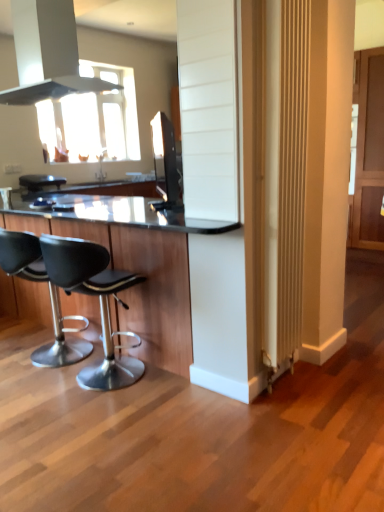
Question: Can you confirm if black leather bar stool at center is bigger than black leather stool at left, positioned as the 1th chair in right-to-left order?

Choices:
 (A) yes
 (B) no

Answer: (B)

Question: Can you confirm if black leather bar stool at center is wider than black leather stool at left, positioned as the 1th chair in right-to-left order?

Choices:
 (A) no
 (B) yes

Answer: (A)

Question: From a real-world perspective, does black leather bar stool at center stand above black leather stool at left, the second chair in the left-to-right sequence?

Choices:
 (A) no
 (B) yes

Answer: (B)

Question: Is black leather bar stool at center thinner than black leather stool at left, the second chair in the left-to-right sequence?

Choices:
 (A) yes
 (B) no

Answer: (A)

Question: Is black leather bar stool at center surrounding black leather stool at left, positioned as the 1th chair in right-to-left order?

Choices:
 (A) yes
 (B) no

Answer: (B)

Question: Is point (99, 366) closer or farther from the camera than point (23, 239)?

Choices:
 (A) farther
 (B) closer

Answer: (A)

Question: Looking at their shapes, would you say black leather stool at left, positioned as the 1th chair in right-to-left order, is wider or thinner than black leather stool at lower left, the first chair positioned from the left?

Choices:
 (A) wide
 (B) thin

Answer: (B)

Question: From the image's perspective, relative to black leather stool at lower left, the first chair positioned from the left, is black leather stool at left, positioned as the 1th chair in right-to-left order, above or below?

Choices:
 (A) below
 (B) above

Answer: (A)

Question: In terms of height, does black leather stool at left, the second chair in the left-to-right sequence, look taller or shorter compared to black leather stool at lower left, the first chair positioned from the left?

Choices:
 (A) short
 (B) tall

Answer: (B)

Question: Choose the correct answer: Is black matte exhaust hood at upper left inside black leather stool at lower left, the 2th chair positioned from the right, or outside it?

Choices:
 (A) inside
 (B) outside

Answer: (B)

Question: Looking at the image, does black matte exhaust hood at upper left seem bigger or smaller compared to black leather stool at lower left, the first chair positioned from the left?

Choices:
 (A) big
 (B) small

Answer: (A)

Question: In terms of width, does black matte exhaust hood at upper left look wider or thinner when compared to black leather stool at lower left, the first chair positioned from the left?

Choices:
 (A) wide
 (B) thin

Answer: (A)

Question: Is point (29, 7) closer or farther from the camera than point (49, 358)?

Choices:
 (A) farther
 (B) closer

Answer: (A)

Question: Based on their sizes in the image, would you say black leather stool at lower left, the first chair positioned from the left, is bigger or smaller than black glass table at center?

Choices:
 (A) big
 (B) small

Answer: (B)

Question: From the image's perspective, is black leather stool at lower left, the 2th chair positioned from the right, located above or below black glass table at center?

Choices:
 (A) below
 (B) above

Answer: (A)